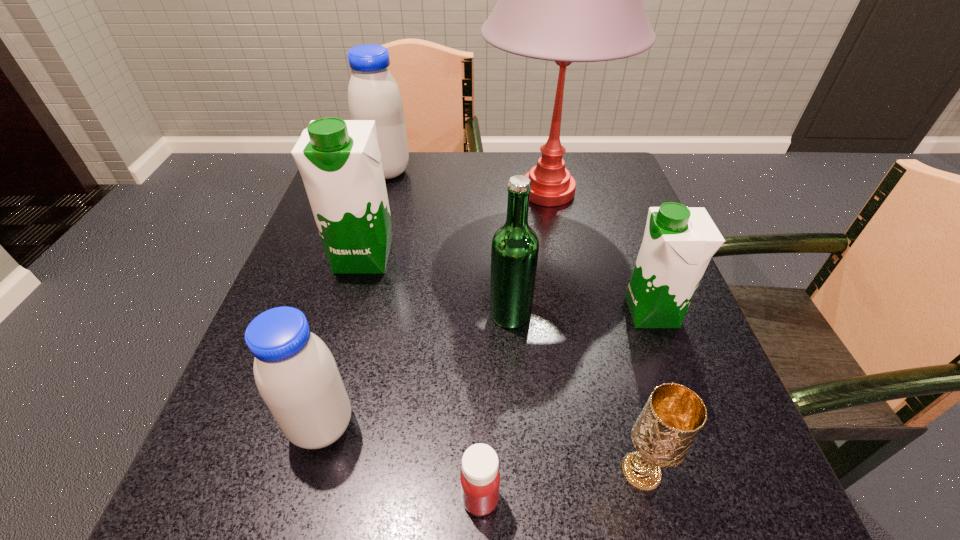
In order to click on chalice positioned at the right edge in this screenshot , I will do `click(673, 416)`.

The height and width of the screenshot is (540, 960). Identify the location of object that is at the far left corner. (373, 94).

Locate an element on the screen. object that is at the far right corner is located at coordinates (566, 0).

Locate an element on the screen. Image resolution: width=960 pixels, height=540 pixels. object located in the near right corner section of the desktop is located at coordinates (673, 416).

In the image, there is a desktop. Where is `vacant space at the far edge`? This screenshot has width=960, height=540. vacant space at the far edge is located at coordinates (471, 165).

You are a GUI agent. You are given a task and a screenshot of the screen. Output one action in this format:
    pyautogui.click(x=<x>, y=<y>)
    Task: Click on the vacant area at the near edge
    This screenshot has width=960, height=540.
    Given the screenshot: What is the action you would take?
    pyautogui.click(x=459, y=539)

This screenshot has height=540, width=960. In the image, there is a desktop. Identify the location of free space at the left edge. (348, 287).

The width and height of the screenshot is (960, 540). In the image, there is a desktop. What are the coordinates of `vacant space at the right edge` in the screenshot? It's located at (600, 296).

You are a GUI agent. You are given a task and a screenshot of the screen. Output one action in this format:
    pyautogui.click(x=<x>, y=<y>)
    Task: Click on the free space at the far right corner
    This screenshot has width=960, height=540.
    Given the screenshot: What is the action you would take?
    pyautogui.click(x=635, y=189)

This screenshot has width=960, height=540. Identify the location of free area in between the rightmost soya milk and the chalice. (646, 392).